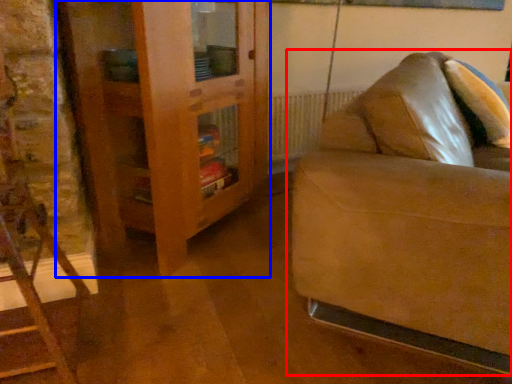
Question: Among these objects, which one is farthest to the camera, studio couch (highlighted by a red box) or dresser (highlighted by a blue box)?

Choices:
 (A) studio couch
 (B) dresser

Answer: (B)